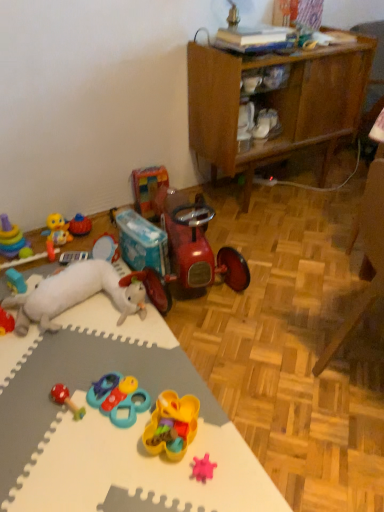
Where is `vacant space in front of shiny red tricycle at center, which appears as the 10th toy when viewed from the left`? vacant space in front of shiny red tricycle at center, which appears as the 10th toy when viewed from the left is located at coordinates (198, 349).